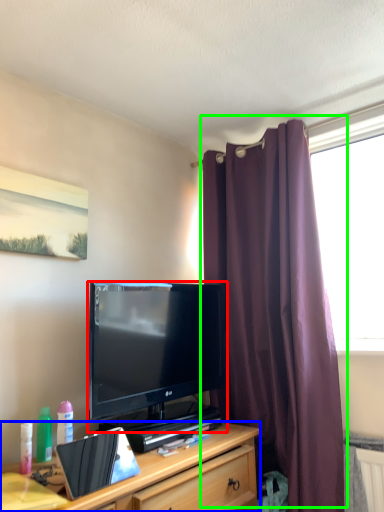
Question: Estimate the real-world distances between objects in this image. Which object is farther from television (highlighted by a red box), cabinetry (highlighted by a blue box) or curtain (highlighted by a green box)?

Choices:
 (A) cabinetry
 (B) curtain

Answer: (B)